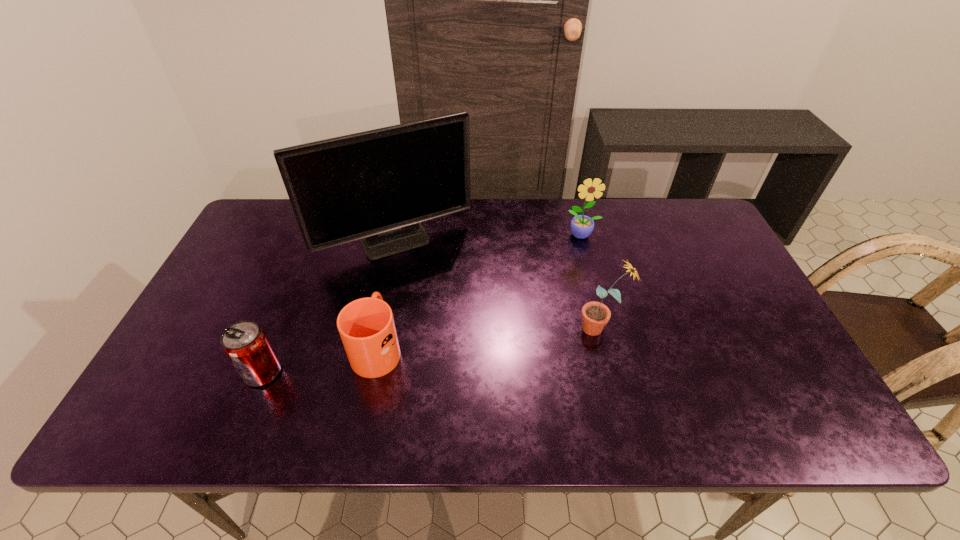
The width and height of the screenshot is (960, 540). I want to click on the tallest object, so click(x=377, y=186).

Find the location of `the nearer sunflower`. the nearer sunflower is located at coordinates (595, 315).

This screenshot has height=540, width=960. Identify the location of the farther sunflower. (581, 226).

This screenshot has width=960, height=540. I want to click on mug, so click(x=366, y=326).

Identify the location of pop soda. (246, 345).

Where is `vacant space located on the front-facing side of the tallest object`? This screenshot has height=540, width=960. vacant space located on the front-facing side of the tallest object is located at coordinates tap(386, 291).

At what (x,y) coordinates should I click in order to perform the action: click on free space located on the flower of the nearer sunflower. Please return your answer as a coordinate pair (x, y). Looking at the image, I should click on (484, 327).

You are a GUI agent. You are given a task and a screenshot of the screen. Output one action in this format:
    pyautogui.click(x=<x>, y=<y>)
    Task: Click on the vacant space located on the flower of the nearer sunflower
    
    Given the screenshot: What is the action you would take?
    pyautogui.click(x=472, y=327)

This screenshot has height=540, width=960. In order to click on free space located on the flower of the nearer sunflower in this screenshot , I will do `click(555, 327)`.

Identify the location of free point located 0.060m on the front-facing side of the farther sunflower. (588, 256).